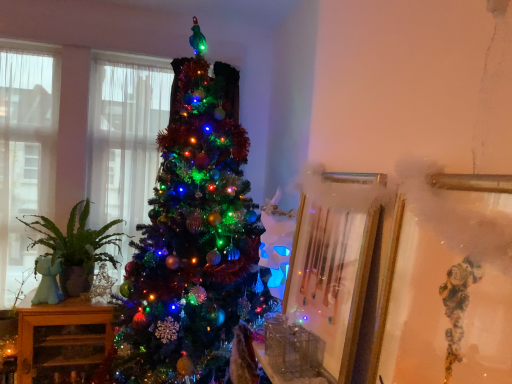
Image resolution: width=512 pixels, height=384 pixels. I want to click on blank space situated above clear glass window at left, acting as the 2th window starting from the right (from a real-world perspective), so click(23, 40).